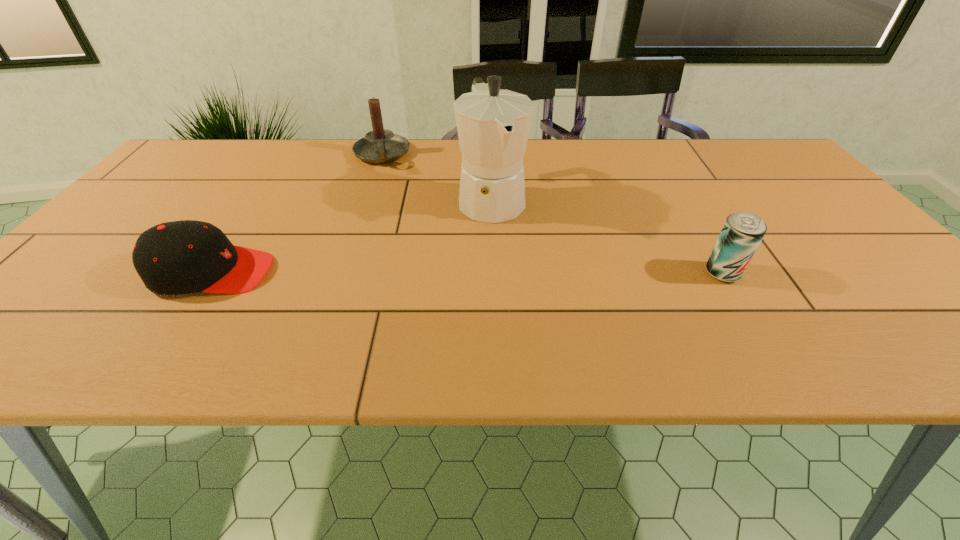
Locate an element on the screen. The image size is (960, 540). vacant space that's between the second tallest object and the cap is located at coordinates (297, 213).

What are the coordinates of `object that is the second nearest to the leftmost object` in the screenshot? It's located at (493, 125).

Choose which object is the nearest neighbor to the cap. Please provide its 2D coordinates. Your answer should be formatted as a tuple, i.e. [(x, y)], where the tuple contains the x and y coordinates of a point satisfying the conditions above.

[(380, 145)]

Identify the location of blank space that satisfies the following two spatial constraints: 1. on the front side of the candle; 2. on the left side of the beer can. (342, 273).